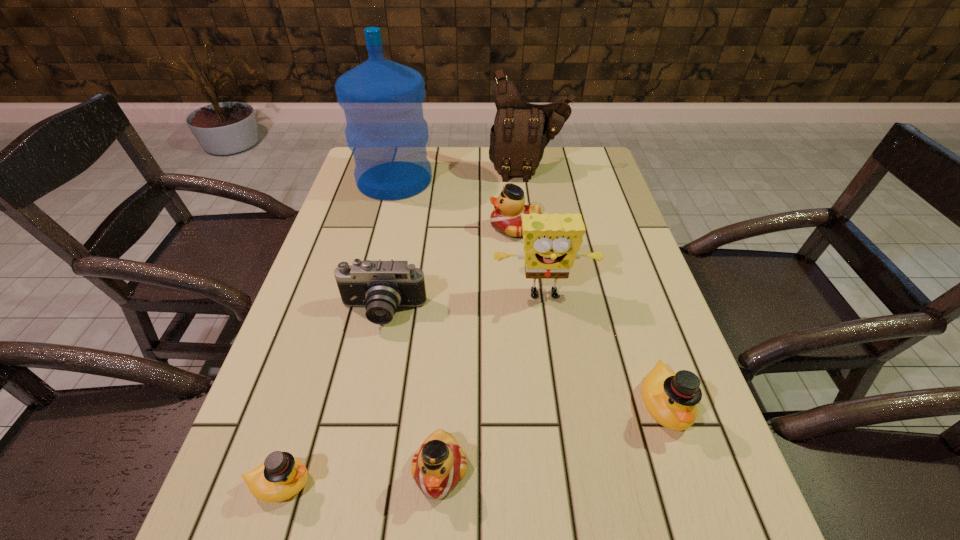
This screenshot has width=960, height=540. What are the coordinates of `sponge that is at the right edge` in the screenshot? It's located at (551, 242).

This screenshot has width=960, height=540. Find the location of `duck positioned at the right edge`. duck positioned at the right edge is located at coordinates (671, 398).

The width and height of the screenshot is (960, 540). I want to click on object situated at the far left corner, so click(382, 100).

Locate an element on the screen. The image size is (960, 540). object present at the far right corner is located at coordinates (521, 131).

Locate an element on the screen. Image resolution: width=960 pixels, height=540 pixels. free spot at the far edge of the desktop is located at coordinates (479, 148).

You are a GUI agent. You are given a task and a screenshot of the screen. Output one action in this format:
    pyautogui.click(x=<x>, y=<y>)
    Task: Click on the vacant space at the left edge of the desktop
    Image resolution: width=960 pixels, height=540 pixels.
    Given the screenshot: What is the action you would take?
    pyautogui.click(x=358, y=249)

In the image, there is a desktop. At what (x,y) coordinates should I click in order to perform the action: click on vacant space at the right edge. Please return your answer as a coordinate pair (x, y). This screenshot has height=540, width=960. Looking at the image, I should click on (636, 408).

I want to click on vacant space at the far right corner of the desktop, so click(x=575, y=157).

Image resolution: width=960 pixels, height=540 pixels. I want to click on vacant point located between the seventh shortest object and the water jug, so click(x=462, y=175).

Locate an element on the screen. free space between the farther yellow duck and the water jug is located at coordinates (530, 292).